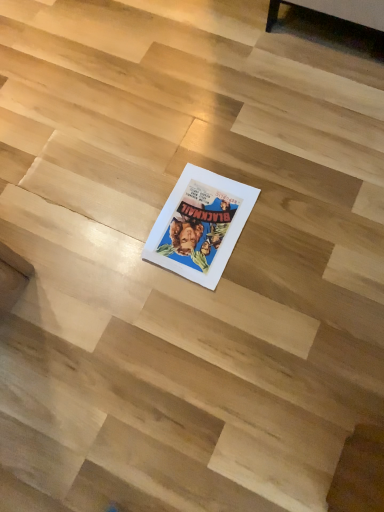
The image size is (384, 512). I want to click on free space to the left of white paper book at center, so click(110, 238).